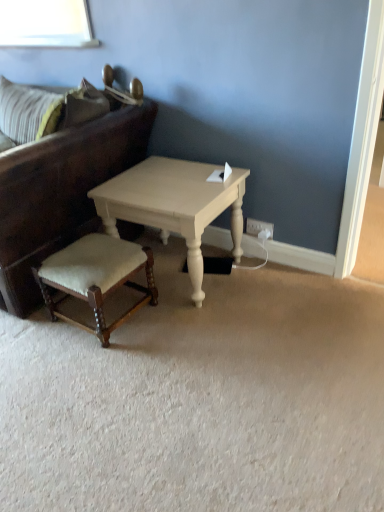
Question: Does point (18, 164) appear closer or farther from the camera than point (269, 227)?

Choices:
 (A) closer
 (B) farther

Answer: (A)

Question: Is dark brown leather studio couch at left in front of or behind white plastic electric outlet at lower right in the image?

Choices:
 (A) front
 (B) behind

Answer: (A)

Question: Estimate the real-world distances between objects in this image. Which object is farther from the dark brown leather studio couch at left?

Choices:
 (A) white plastic electric outlet at lower right
 (B) velvet beige stool at lower left
 (C) white painted wood coffee table at center

Answer: (A)

Question: Considering the real-world distances, which object is closest to the dark brown leather studio couch at left?

Choices:
 (A) velvet beige stool at lower left
 (B) white plastic electric outlet at lower right
 (C) white painted wood coffee table at center

Answer: (C)